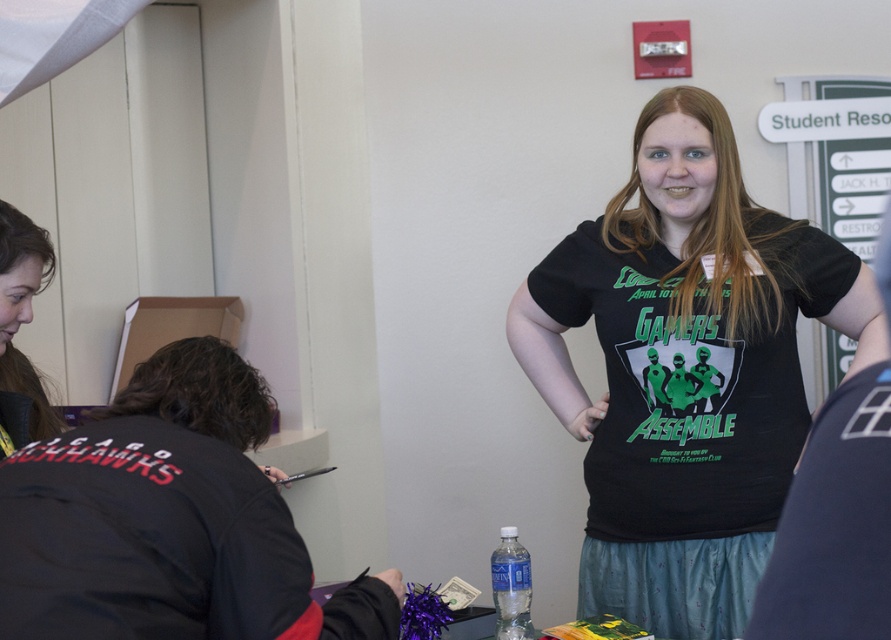
Between black matte shirt at center and brown hair at left, which one appears on the left side from the viewer's perspective?

brown hair at left is more to the left.

Which is above, black matte shirt at center or brown hair at left?

Positioned higher is black matte shirt at center.

Measure the distance between point (729, 336) and camera.

A: Point (729, 336) is 6.06 feet from camera.

Image resolution: width=891 pixels, height=640 pixels. In order to click on black matte shirt at center in this screenshot , I will do `click(706, 228)`.

This screenshot has height=640, width=891. Describe the element at coordinates (685, 369) in the screenshot. I see `black matte t-shirt at center` at that location.

Does black matte t-shirt at center come in front of brown hair at left?

Result: No, it is not.

Is point (751, 352) closer to viewer compared to point (3, 420)?

No, (751, 352) is behind (3, 420).

At what (x,y) coordinates should I click in order to perform the action: click on black matte t-shirt at center. Please return your answer as a coordinate pair (x, y). The height and width of the screenshot is (640, 891). Looking at the image, I should click on (685, 369).

Is black matte t-shirt at center above black matte shirt at center?

No, black matte t-shirt at center is not above black matte shirt at center.

Does point (710, 508) come in front of point (769, 244)?

Yes.

The height and width of the screenshot is (640, 891). What are the coordinates of `black matte t-shirt at center` in the screenshot? It's located at (685, 369).